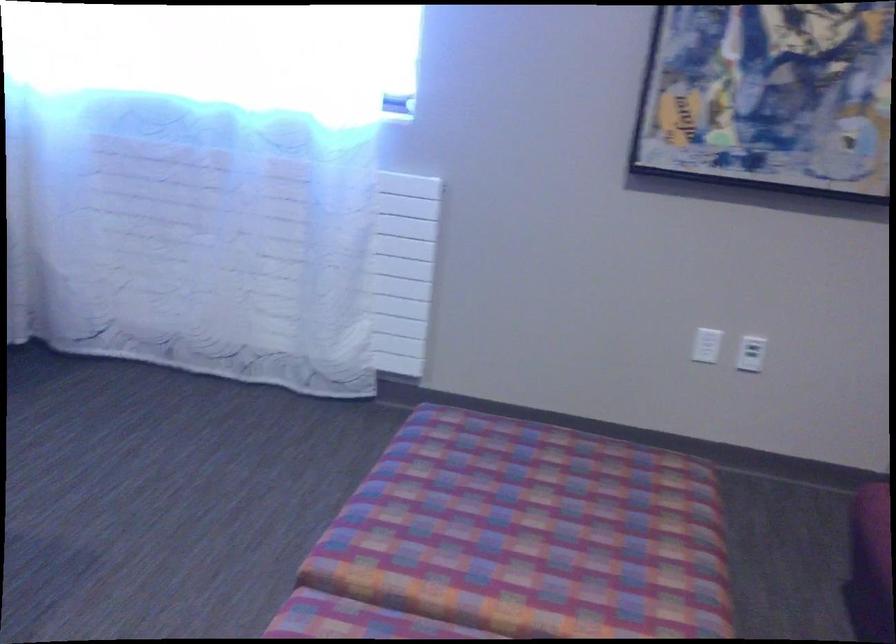
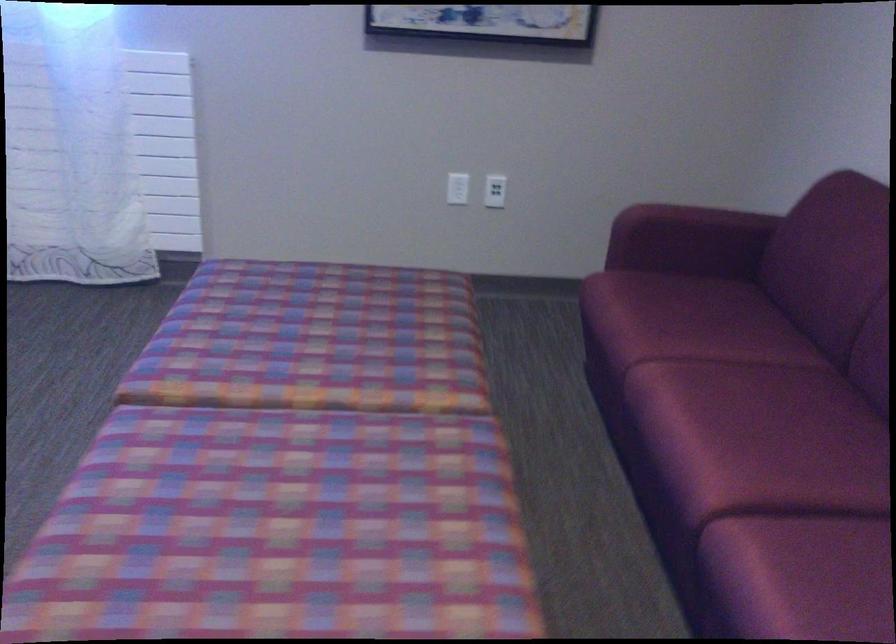
In the second image, find the point that corresponds to (748,355) in the first image.

(495, 191)